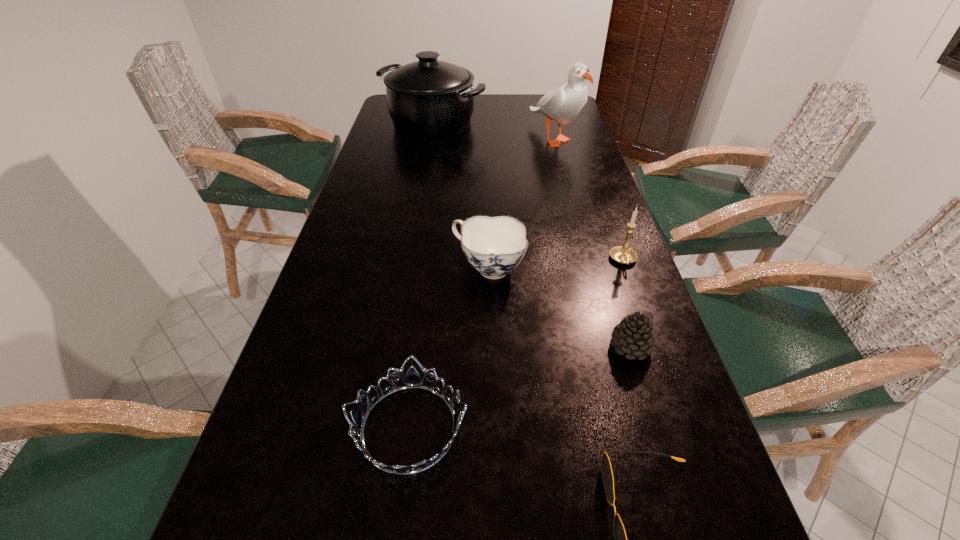
This screenshot has width=960, height=540. Find the location of `vacant space located on the right of the chinaware`. vacant space located on the right of the chinaware is located at coordinates (545, 268).

You are a GUI agent. You are given a task and a screenshot of the screen. Output one action in this format:
    pyautogui.click(x=<x>, y=<y>)
    Task: Click on the free space located at the narrow end of the fifth tallest object
    The image size is (960, 540).
    Given the screenshot: What is the action you would take?
    pyautogui.click(x=560, y=346)

Locate an element on the screen. The width and height of the screenshot is (960, 540). free space located 0.380m at the narrow end of the fifth tallest object is located at coordinates (420, 346).

Locate an element on the screen. The width and height of the screenshot is (960, 540). free space located at the narrow end of the fifth tallest object is located at coordinates (470, 346).

The height and width of the screenshot is (540, 960). Find the location of `object positioned at the far edge`. object positioned at the far edge is located at coordinates (429, 99).

You are a GUI agent. You are given a task and a screenshot of the screen. Output one action in this format:
    pyautogui.click(x=<x>, y=<y>)
    Task: Click on the saucepan that is positioned at the left edge
    The width and height of the screenshot is (960, 540).
    Given the screenshot: What is the action you would take?
    pyautogui.click(x=429, y=99)

This screenshot has height=540, width=960. In order to click on tiara present at the left edge in this screenshot , I will do `click(412, 380)`.

Identify the location of gull that is at the right edge. (562, 105).

At what (x,y) coordinates should I click in order to perform the action: click on candle holder positioned at the right edge. Please return your answer as a coordinate pair (x, y). The image size is (960, 540). Looking at the image, I should click on [623, 254].

You are a GUI agent. You are given a task and a screenshot of the screen. Output one action in this format:
    pyautogui.click(x=<x>, y=<y>)
    Task: Click on the pinecone positioned at the right edge
    
    Given the screenshot: What is the action you would take?
    634,335